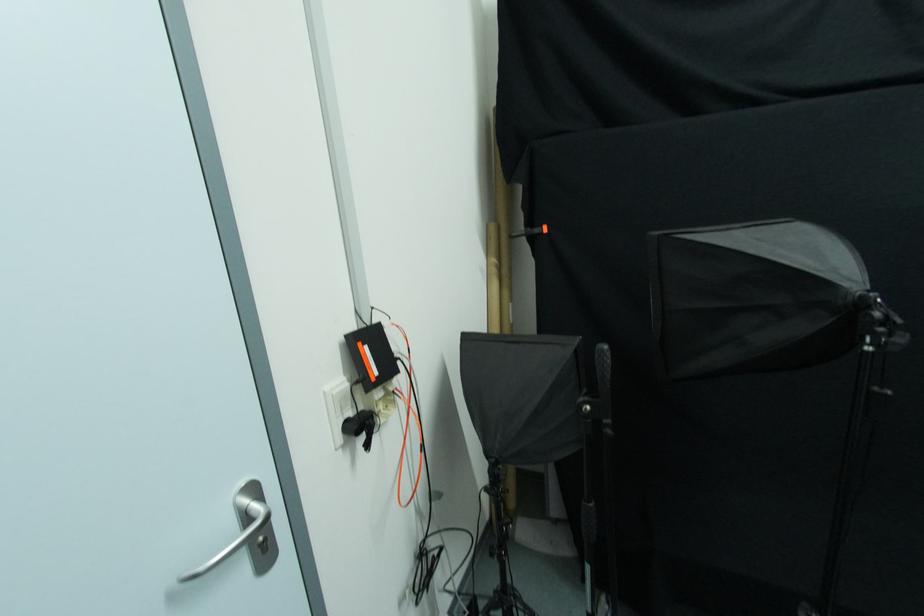
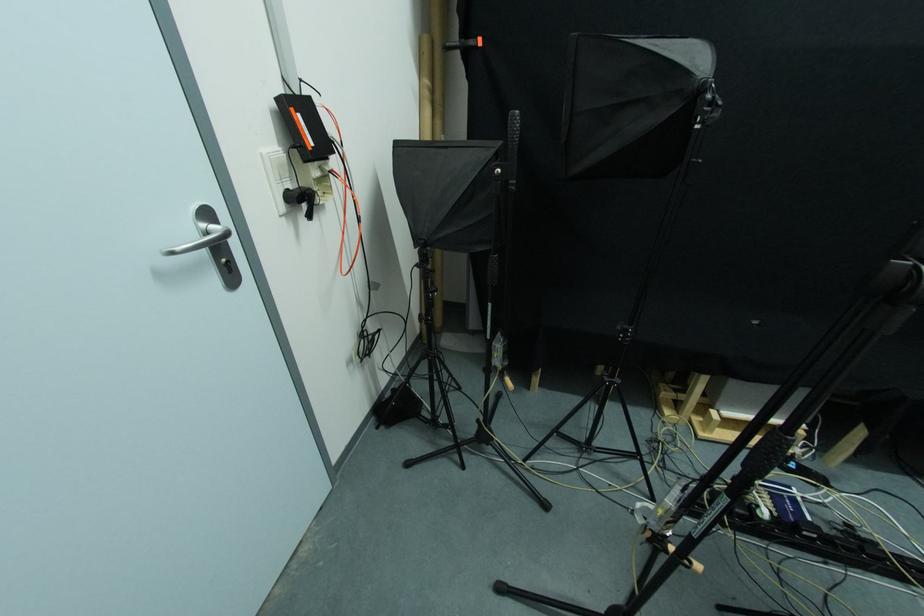
Locate, in the second image, the point that corresponds to (325,395) in the first image.

(262, 156)